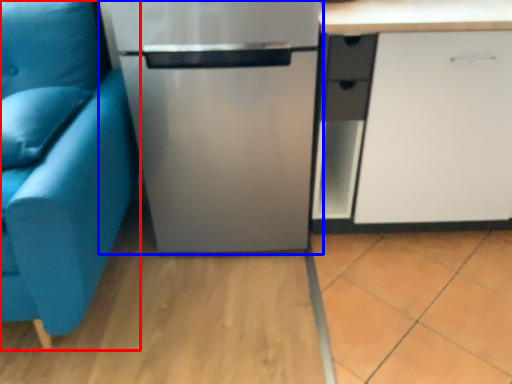
Question: Which point is further to the camera, studio couch (highlighted by a red box) or refrigerator (highlighted by a blue box)?

Choices:
 (A) studio couch
 (B) refrigerator

Answer: (B)